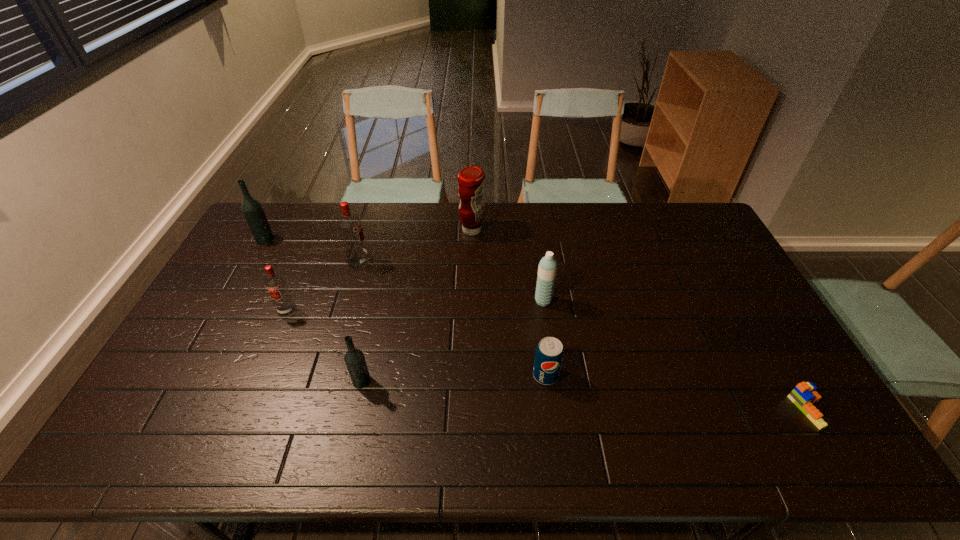
Identify the location of free space located 0.260m on the right of the rightmost vodka. The height and width of the screenshot is (540, 960). [x=468, y=381].

This screenshot has width=960, height=540. Find the location of `vacant space located on the left of the seventh tallest object`. vacant space located on the left of the seventh tallest object is located at coordinates (413, 375).

Where is `free space located on the back of the nearest object`? The width and height of the screenshot is (960, 540). free space located on the back of the nearest object is located at coordinates tap(785, 370).

You are a GUI agent. You are given a task and a screenshot of the screen. Output one action in this format:
    pyautogui.click(x=<x>, y=<y>)
    Task: Click on the condiment positioned at the far edge
    Image resolution: width=960 pixels, height=540 pixels.
    Given the screenshot: What is the action you would take?
    pyautogui.click(x=471, y=179)

Where is `vodka that is at the far edge`? Image resolution: width=960 pixels, height=540 pixels. vodka that is at the far edge is located at coordinates (252, 209).

At what (x,y) coordinates should I click in order to perform the action: click on object that is at the near edge. Please return your answer as a coordinate pair (x, y). Looking at the image, I should click on (804, 395).

This screenshot has height=540, width=960. What are the coordinates of `object present at the left edge` in the screenshot? It's located at (x=252, y=209).

Find the location of a particular element. object that is at the right edge is located at coordinates (804, 395).

I want to click on object that is at the far left corner, so click(252, 209).

At what (x,y) coordinates should I click in order to perform the action: click on object at the near right corner. Please return your answer as a coordinate pair (x, y). Looking at the image, I should click on (804, 395).